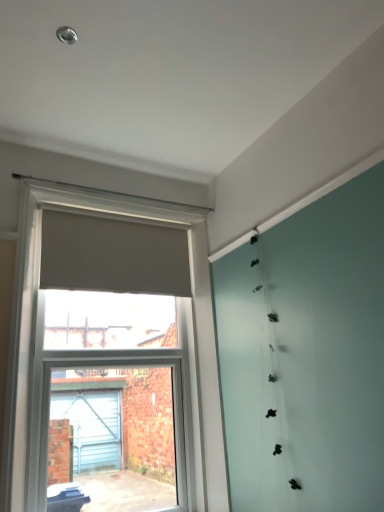
Find the location of a particular element. Image resolution: width=384 pixels, height=512 pixels. matte beige curtain at upper center is located at coordinates (113, 256).

The width and height of the screenshot is (384, 512). Describe the element at coordinates (113, 256) in the screenshot. I see `matte beige curtain at upper center` at that location.

You are a GUI agent. You are given a task and a screenshot of the screen. Output one action in this format:
    pyautogui.click(x=<x>, y=<y>)
    Task: Click on the matte gray roller blind at left
    The width and height of the screenshot is (384, 512).
    Given the screenshot: What is the action you would take?
    pyautogui.click(x=179, y=340)

What do you see at coordinates (179, 340) in the screenshot? I see `matte gray roller blind at left` at bounding box center [179, 340].

The image size is (384, 512). I want to click on matte beige curtain at upper center, so click(x=113, y=256).

In the scene shown: Considering the relative positions of matte gray roller blind at left and matte beige curtain at upper center in the image provided, is matte gray roller blind at left to the right of matte beige curtain at upper center from the viewer's perspective?

Indeed, matte gray roller blind at left is positioned on the right side of matte beige curtain at upper center.

Between matte gray roller blind at left and matte beige curtain at upper center, which one is positioned behind?

matte beige curtain at upper center.

Considering the positions of points (9, 382) and (47, 267), is point (9, 382) farther from camera compared to point (47, 267)?

No.

Based on the photo, from the image's perspective, is matte gray roller blind at left located beneath matte beige curtain at upper center?

Correct, matte gray roller blind at left appears lower than matte beige curtain at upper center in the image.

From a real-world perspective, is matte gray roller blind at left physically above matte beige curtain at upper center?

No, from a real-world perspective, matte gray roller blind at left is not above matte beige curtain at upper center.

Considering the sizes of objects matte gray roller blind at left and matte beige curtain at upper center in the image provided, who is wider, matte gray roller blind at left or matte beige curtain at upper center?

With larger width is matte gray roller blind at left.

Which of these two, matte gray roller blind at left or matte beige curtain at upper center, stands taller?

Standing taller between the two is matte gray roller blind at left.

Based on their sizes in the image, would you say matte gray roller blind at left is bigger or smaller than matte beige curtain at upper center?

In the image, matte gray roller blind at left appears to be larger than matte beige curtain at upper center.

Is matte beige curtain at upper center completely or partially inside matte gray roller blind at left?

Yes, matte beige curtain at upper center is a part of matte gray roller blind at left.

Are matte gray roller blind at left and matte beige curtain at upper center located far from each other?

No, matte gray roller blind at left is in close proximity to matte beige curtain at upper center.

Is matte gray roller blind at left facing towards matte beige curtain at upper center?

Yes, matte gray roller blind at left is turned towards matte beige curtain at upper center.

In order to click on window on the right of matte beige curtain at upper center in this screenshot , I will do `click(179, 340)`.

In the scene shown: Is matte beige curtain at upper center at the left side of matte gray roller blind at left?

Indeed, matte beige curtain at upper center is positioned on the left side of matte gray roller blind at left.

Which object is further away from the camera taking this photo, matte beige curtain at upper center or matte gray roller blind at left?

matte beige curtain at upper center is further from the camera.

Is point (74, 234) positioned after point (125, 218)?

No, it is in front of (125, 218).

From the image's perspective, is matte beige curtain at upper center above matte gray roller blind at left?

Yes, from the image's perspective, matte beige curtain at upper center is above matte gray roller blind at left.

From a real-world perspective, is matte beige curtain at upper center above or below matte gray roller blind at left?

matte beige curtain at upper center is above matte gray roller blind at left.

In terms of width, does matte beige curtain at upper center look wider or thinner when compared to matte gray roller blind at left?

matte beige curtain at upper center is thinner than matte gray roller blind at left.

Does matte beige curtain at upper center have a lesser height compared to matte gray roller blind at left?

Yes.

In terms of size, does matte beige curtain at upper center appear bigger or smaller than matte gray roller blind at left?

matte beige curtain at upper center is smaller than matte gray roller blind at left.

Does matte beige curtain at upper center contain matte gray roller blind at left?

No, matte beige curtain at upper center does not contain matte gray roller blind at left.

Are matte beige curtain at upper center and matte gray roller blind at left making contact?

No.

Could you tell me if matte beige curtain at upper center is turned towards matte gray roller blind at left?

Yes.

Can you tell me how much matte beige curtain at upper center and matte gray roller blind at left differ in facing direction?

0.00343 degrees.

This screenshot has width=384, height=512. In the image, there is a matte beige curtain at upper center. In order to click on window below it (from a real-world perspective) in this screenshot , I will do `click(179, 340)`.

Find the location of a particular element. This screenshot has width=384, height=512. curtain on the left of matte gray roller blind at left is located at coordinates (113, 256).

Locate an element on the screen. window on the right of matte beige curtain at upper center is located at coordinates (179, 340).